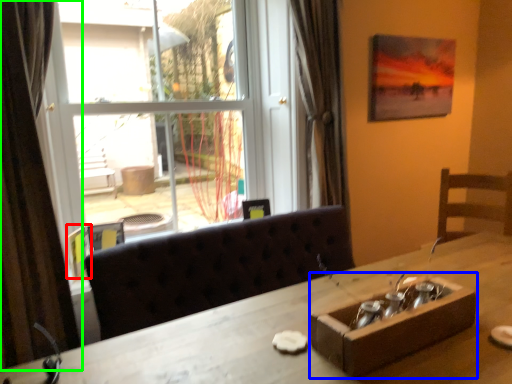
Question: Considering the real-world distances, which object is closest to picture frame (highlighted by a red box)? cardboard box (highlighted by a blue box) or curtain (highlighted by a green box).

Choices:
 (A) cardboard box
 (B) curtain

Answer: (B)